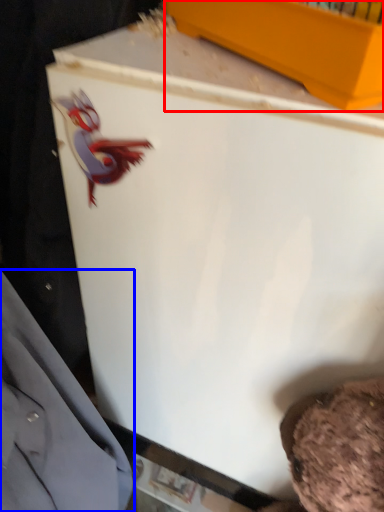
Question: Which point is further to the camera, box (highlighted by a red box) or dress shirt (highlighted by a blue box)?

Choices:
 (A) box
 (B) dress shirt

Answer: (A)